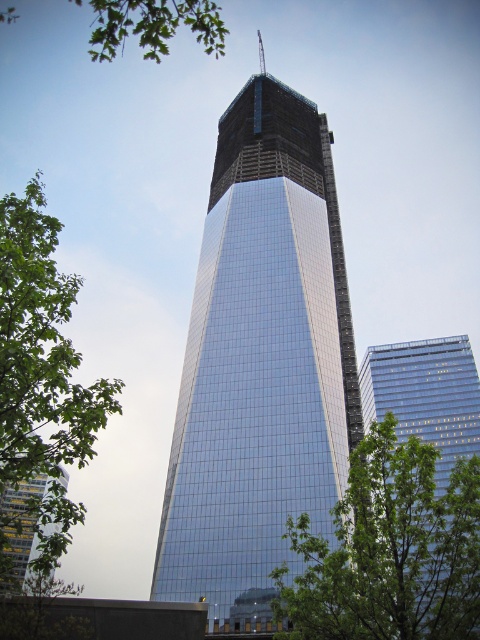
Question: Is glossy glass skyscraper at center below green leafy branch at upper left?

Choices:
 (A) yes
 (B) no

Answer: (A)

Question: Which object is the farthest from the green leafy tree at left?

Choices:
 (A) gold glass tower at left
 (B) glassy reflective skyscraper at right

Answer: (B)

Question: Estimate the real-world distances between objects in this image. Which object is closer to the green leafy tree at left?

Choices:
 (A) glassy reflective skyscraper at right
 (B) glossy glass skyscraper at center
 (C) gold glass tower at left
 (D) green leafy tree at center

Answer: (C)

Question: Can you confirm if glassy reflective skyscraper at right is positioned below gold glass tower at left?

Choices:
 (A) no
 (B) yes

Answer: (A)

Question: Estimate the real-world distances between objects in this image. Which object is closer to the green leafy branch at upper left?

Choices:
 (A) gold glass tower at left
 (B) glossy glass skyscraper at center

Answer: (B)

Question: Does green leafy tree at left lie in front of glassy reflective skyscraper at right?

Choices:
 (A) yes
 (B) no

Answer: (A)